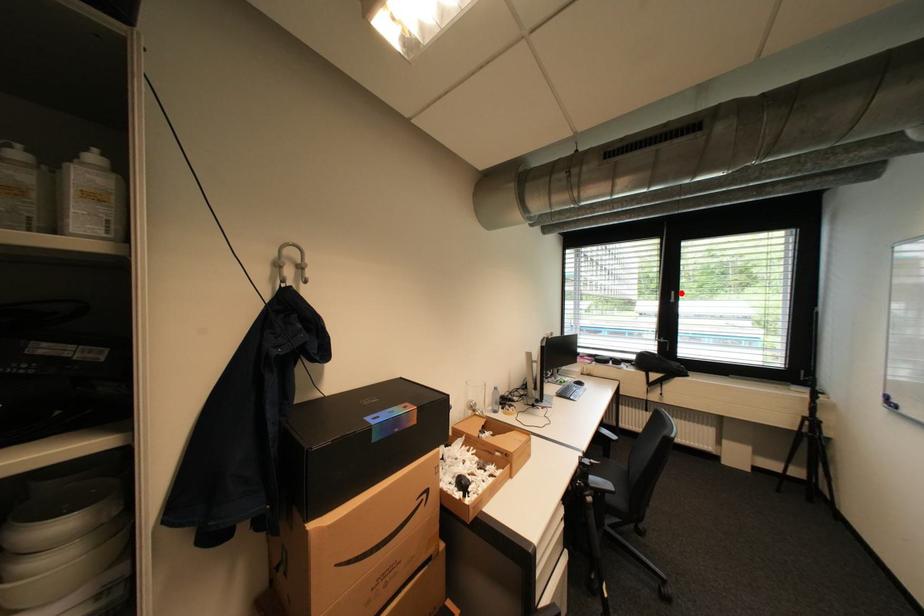
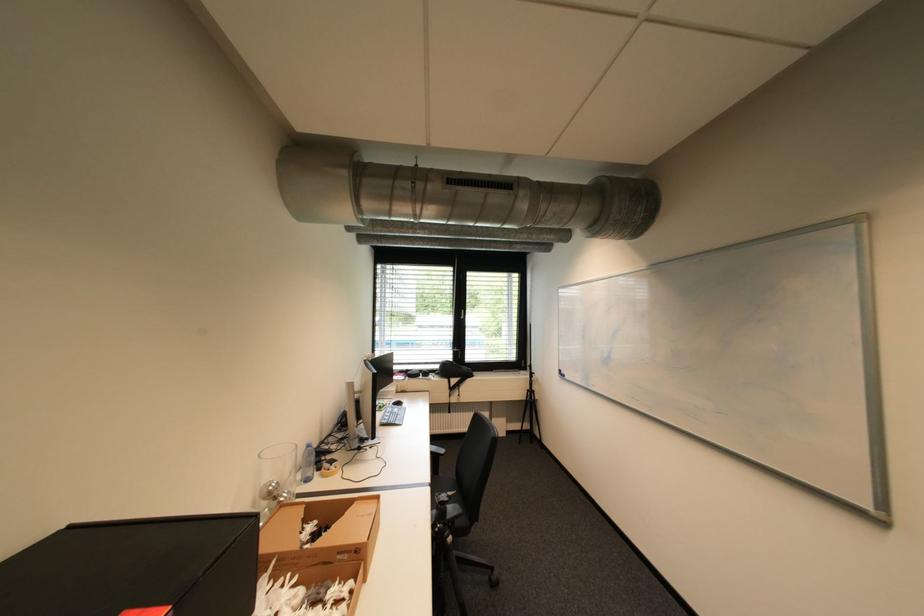
Where in the second image is the point corresponding to the highlighted location from the first image?

(470, 312)